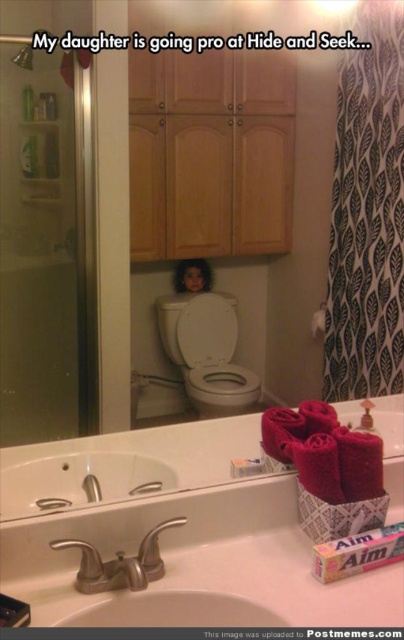
Is black printed fabric shower curtain at right smaller than white glossy toilet bowl at center?

Incorrect, black printed fabric shower curtain at right is not smaller in size than white glossy toilet bowl at center.

I want to click on black printed fabric shower curtain at right, so pyautogui.click(x=368, y=214).

Which is in front, point (385, 316) or point (214, 385)?

Positioned in front is point (385, 316).

At what (x,y) coordinates should I click in order to perform the action: click on black printed fabric shower curtain at right. Please return your answer as a coordinate pair (x, y). The height and width of the screenshot is (640, 404). Looking at the image, I should click on (368, 214).

Which is more to the left, brushed metal faucet at lower left or translucent plastic bottle at upper left?

Positioned to the left is translucent plastic bottle at upper left.

Find the location of `brushed metal faucet at lower left`. brushed metal faucet at lower left is located at coordinates (119, 563).

Can you confirm if white glossy toilet bowl at center is shorter than translucent plastic bottle at upper left?

No, white glossy toilet bowl at center is not shorter than translucent plastic bottle at upper left.

Does white glossy toilet bowl at center appear over translucent plastic bottle at upper left?

No.

The height and width of the screenshot is (640, 404). Describe the element at coordinates (206, 349) in the screenshot. I see `white glossy toilet bowl at center` at that location.

Where is `white glossy toilet bowl at center`? This screenshot has width=404, height=640. white glossy toilet bowl at center is located at coordinates (206, 349).